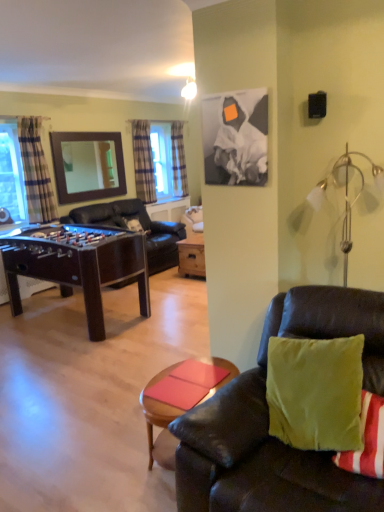
Find the location of `free space in front of mahogany wood foosball table at left`. free space in front of mahogany wood foosball table at left is located at coordinates (75, 380).